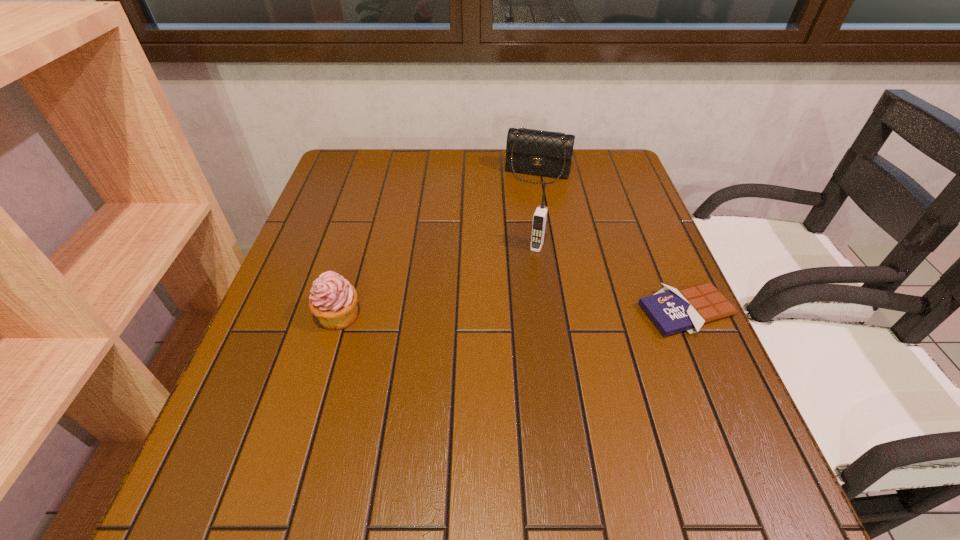
Image resolution: width=960 pixels, height=540 pixels. In order to click on the leftmost object in this screenshot , I will do `click(333, 300)`.

Identify the location of the rightmost object. The height and width of the screenshot is (540, 960). (672, 311).

The image size is (960, 540). I want to click on chocolate bar, so click(672, 311).

I want to click on clutch bag, so click(x=535, y=152).

Where is `the tallest object`? The height and width of the screenshot is (540, 960). the tallest object is located at coordinates coord(540,216).

Find the location of a particular element. The image size is (960, 540). cellular telephone is located at coordinates (540, 216).

Image resolution: width=960 pixels, height=540 pixels. What are the coordinates of `vacant space situated on the right of the cupcake` in the screenshot? It's located at [x=419, y=315].

At what (x,y) coordinates should I click in order to perform the action: click on vacant space located on the left of the rightmost object. Please return your answer as a coordinate pair (x, y). The image size is (960, 540). Looking at the image, I should click on (575, 312).

I want to click on blank space located on the front flap of the clutch bag, so click(513, 247).

The width and height of the screenshot is (960, 540). I want to click on vacant area located on the front flap of the clutch bag, so click(521, 219).